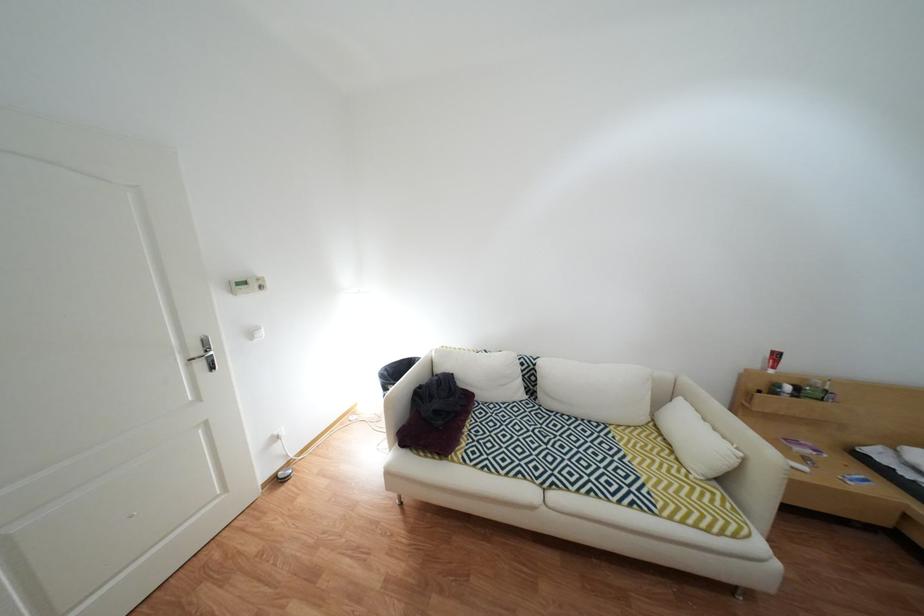
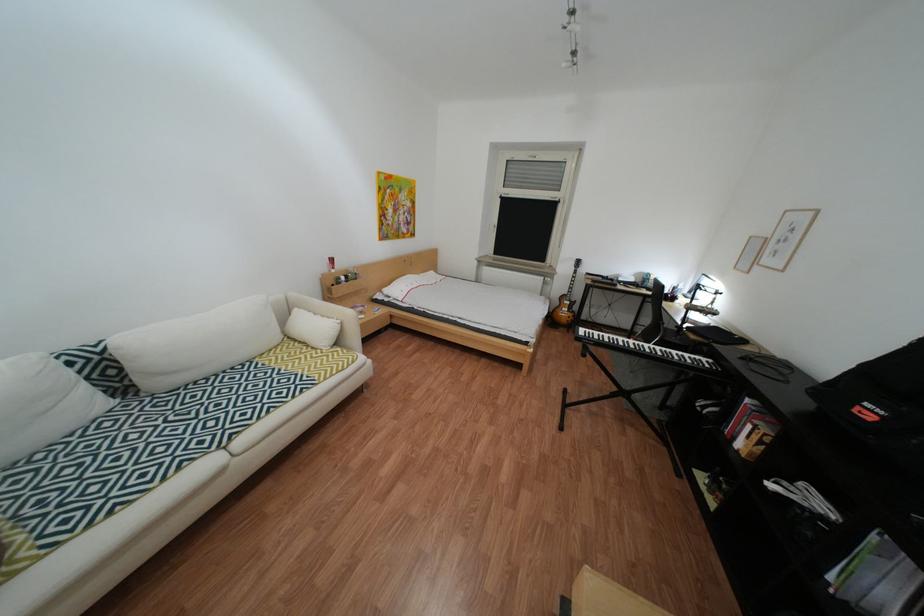
Where in the second image is the point corresponding to point (550, 363) from the first image?

(114, 351)